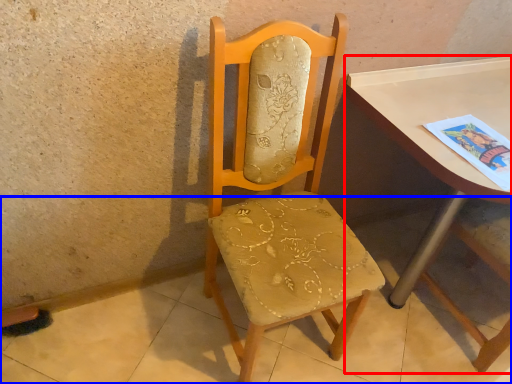
Question: Which of the following is the farthest to the observer, table (highlighted by a red box) or concrete (highlighted by a blue box)?

Choices:
 (A) table
 (B) concrete

Answer: (A)